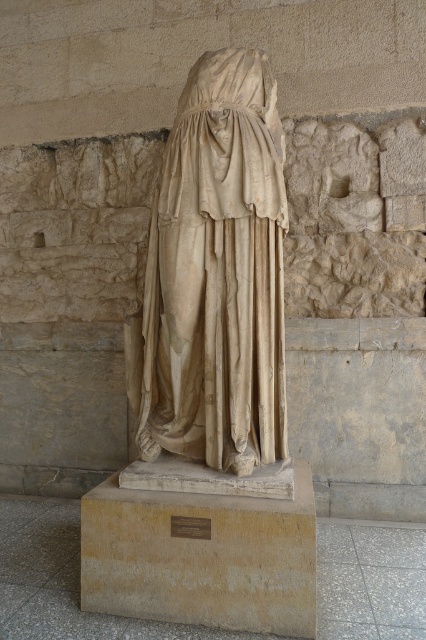
Question: Is beige stone statue at center bigger than beige stone pedestal at center?

Choices:
 (A) yes
 (B) no

Answer: (A)

Question: Can you confirm if beige stone statue at center is thinner than beige stone pedestal at center?

Choices:
 (A) no
 (B) yes

Answer: (B)

Question: Which point appears closest to the camera in this image?

Choices:
 (A) [141, 500]
 (B) [187, 369]

Answer: (A)

Question: Among these objects, which one is farthest from the camera?

Choices:
 (A) beige stone pedestal at center
 (B) beige stone statue at center

Answer: (B)

Question: Is beige stone statue at center further to the viewer compared to beige stone pedestal at center?

Choices:
 (A) yes
 (B) no

Answer: (A)